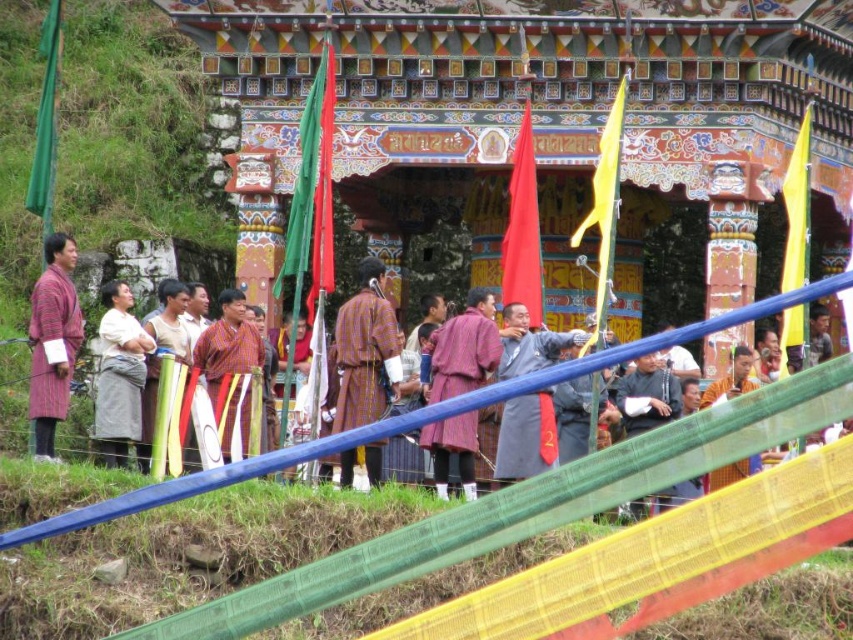
You are standing in front of a traditional Bhutanese temple and see two points marked in the scene. The first point is at coordinates point (526,474) and the second is at point (228,380). Which of these points is nearer to you?

Point (526,474) is closer to the viewer than point (228,380).

You are a photographer standing in front of the Bhutanese structure. You want to take a photo that includes both point (230,305) and point (474,356). Which point is closer to your camera?

Point (230,305) is further to the camera than point (474,356), so the point closer to the camera is point (474,356).